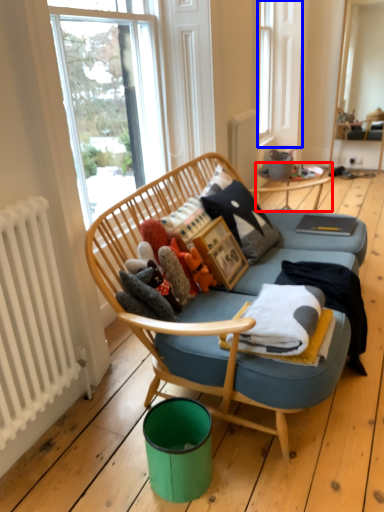
Question: Among these objects, which one is nearest to the camera, table (highlighted by a red box) or bay window (highlighted by a blue box)?

Choices:
 (A) table
 (B) bay window

Answer: (A)